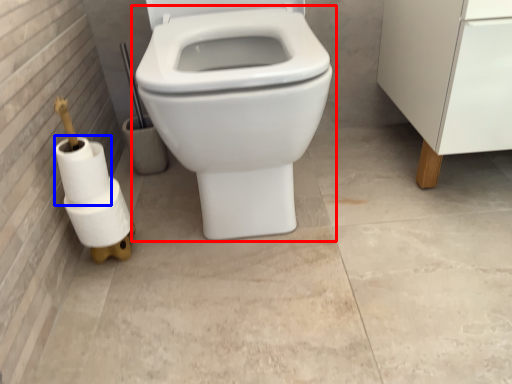
Question: Which object is closer to the camera taking this photo, toilet (highlighted by a red box) or toilet paper (highlighted by a blue box)?

Choices:
 (A) toilet
 (B) toilet paper

Answer: (A)